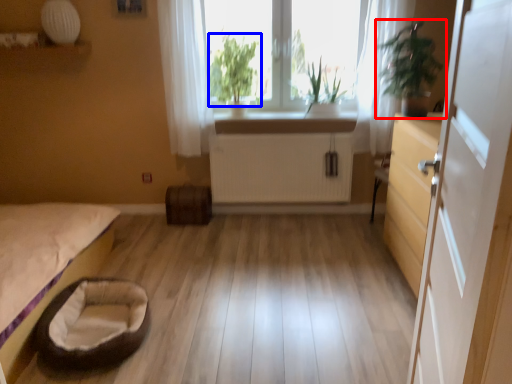
Question: Among these objects, which one is farthest to the camera, houseplant (highlighted by a red box) or plant (highlighted by a blue box)?

Choices:
 (A) houseplant
 (B) plant

Answer: (B)